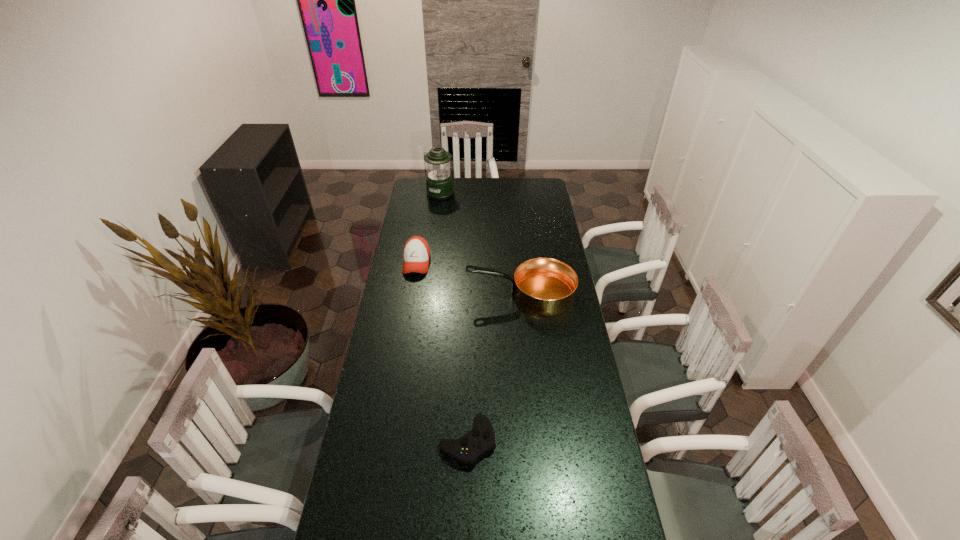
Where is `vacant region between the frying pan and the nearest object`? vacant region between the frying pan and the nearest object is located at coordinates (494, 368).

Where is `vacant region between the baseball cap and the third shortest object`? The height and width of the screenshot is (540, 960). vacant region between the baseball cap and the third shortest object is located at coordinates (468, 279).

The width and height of the screenshot is (960, 540). Find the location of `object that stands as the third closest to the baseball cap`. object that stands as the third closest to the baseball cap is located at coordinates (470, 447).

The height and width of the screenshot is (540, 960). Find the location of `object that stands as the closest to the baseball cap`. object that stands as the closest to the baseball cap is located at coordinates (543, 286).